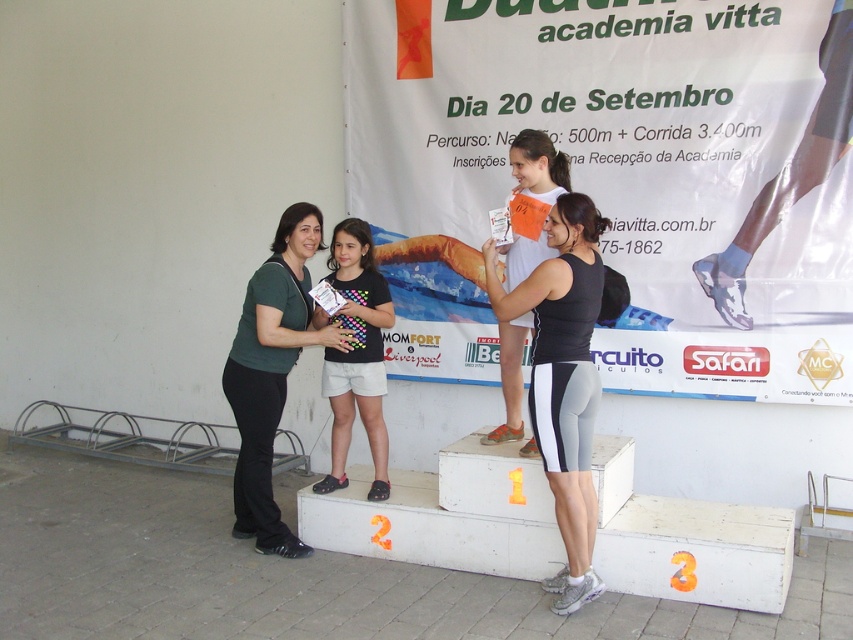
Question: Which point is farther from the camera taking this photo?

Choices:
 (A) (375, 349)
 (B) (318, 243)
 (C) (589, 225)

Answer: (A)

Question: Can you confirm if black matte tank top at center is smaller than green matte shirt at center?

Choices:
 (A) yes
 (B) no

Answer: (A)

Question: Does green matte shirt at center appear on the right side of orange paper tag at center?

Choices:
 (A) yes
 (B) no

Answer: (B)

Question: Estimate the real-world distances between objects in this image. Which object is farther from the green matte shirt at center?

Choices:
 (A) orange paper tag at center
 (B) black matte tank top at center

Answer: (B)

Question: Which object is the farthest from the black matte tank top at center?

Choices:
 (A) black fabric shirt at center
 (B) orange paper tag at center

Answer: (A)

Question: Is green matte shirt at center in front of black fabric shirt at center?

Choices:
 (A) yes
 (B) no

Answer: (A)